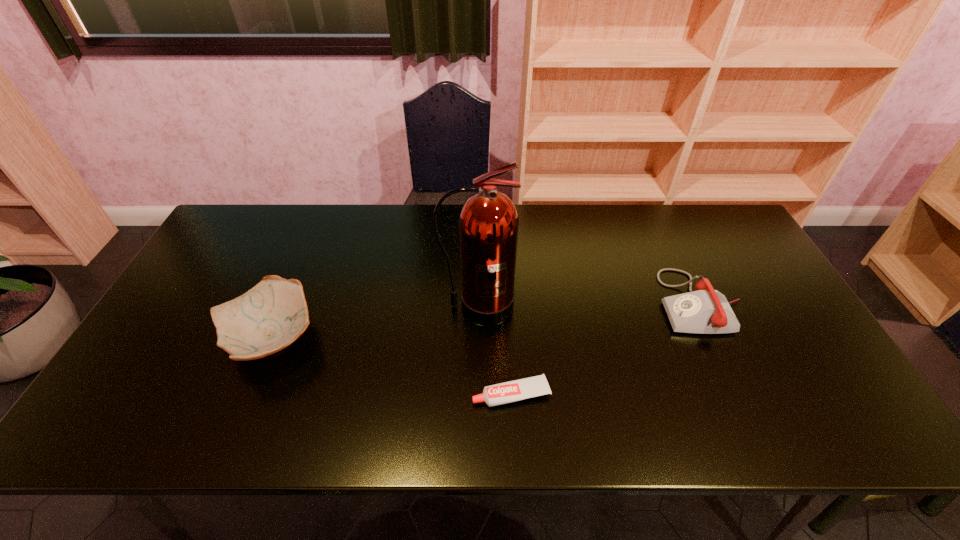
What are the coordinates of `vacant area located on the dial of the rightmost object` in the screenshot? It's located at (621, 302).

I want to click on vacant space located on the right of the shortest object, so click(x=584, y=394).

Where is `object located in the near edge section of the desktop`? Image resolution: width=960 pixels, height=540 pixels. object located in the near edge section of the desktop is located at coordinates (512, 391).

Identify the location of object that is at the right edge. The width and height of the screenshot is (960, 540). (705, 311).

Where is `vacant region at the far edge of the desktop`? This screenshot has width=960, height=540. vacant region at the far edge of the desktop is located at coordinates (318, 221).

The width and height of the screenshot is (960, 540). Identify the location of vacant area at the near edge of the desktop. (358, 416).

Identify the location of vacant space at the left edge of the desktop. (207, 268).

In the image, there is a desktop. Where is `vacant space at the near left corner`? The image size is (960, 540). vacant space at the near left corner is located at coordinates (123, 413).

At what (x,y) coordinates should I click in order to perform the action: click on free space that is in between the tallest object and the rightmost object. Please return your answer as a coordinate pair (x, y). The height and width of the screenshot is (540, 960). Looking at the image, I should click on coord(588,305).

What are the coordinates of `free space that is in between the tallest object and the pottery` in the screenshot? It's located at (374, 323).